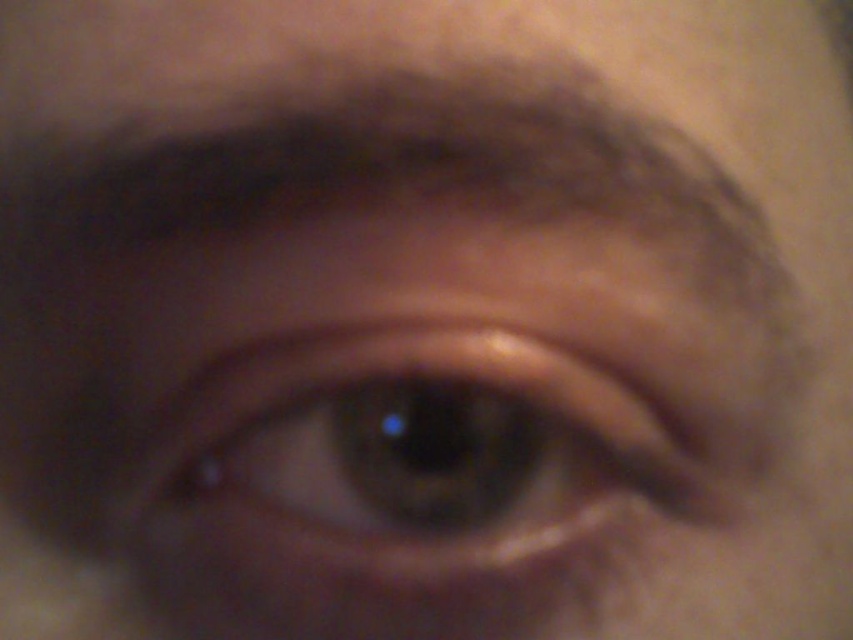
Does brown matte eye at center appear on the right side of dark brown hair at upper center?

Indeed, brown matte eye at center is positioned on the right side of dark brown hair at upper center.

Is brown matte eye at center behind dark brown hair at upper center?

That is True.

Locate an element on the screen. brown matte eye at center is located at coordinates (413, 452).

Find the location of a particular element. brown matte eye at center is located at coordinates (413, 452).